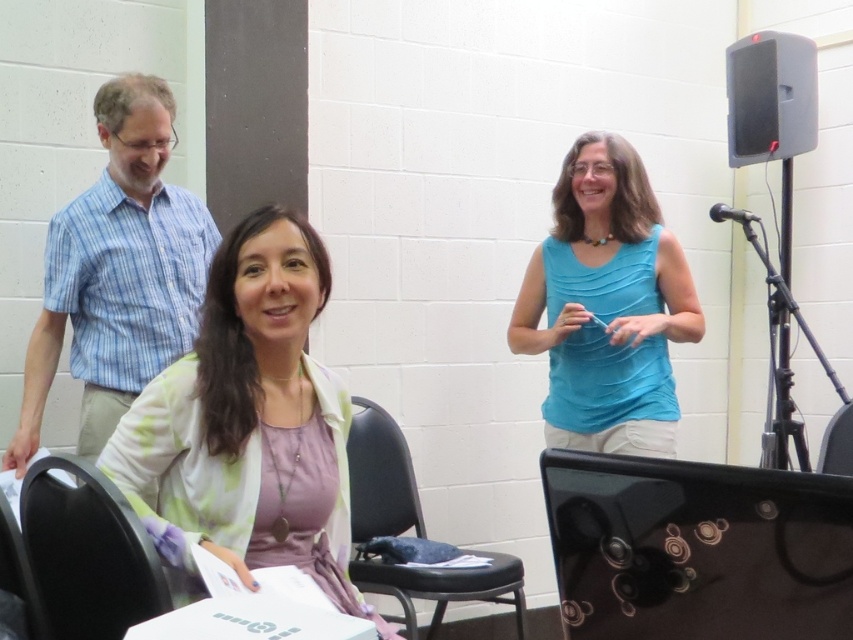
You are a photographer setting up for an event. You need to ensure that both the pastel floral cardigan at center and the blue fabric shirt at center are visible in your photo. Based on their positions, which clothing item is closer to the camera?

The pastel floral cardigan at center is in front of the blue fabric shirt at center, so it is closer to the camera.

What object is located at the coordinates point (697, 548)?

The point (697, 548) indicates the location of the black glossy laptop at lower right.